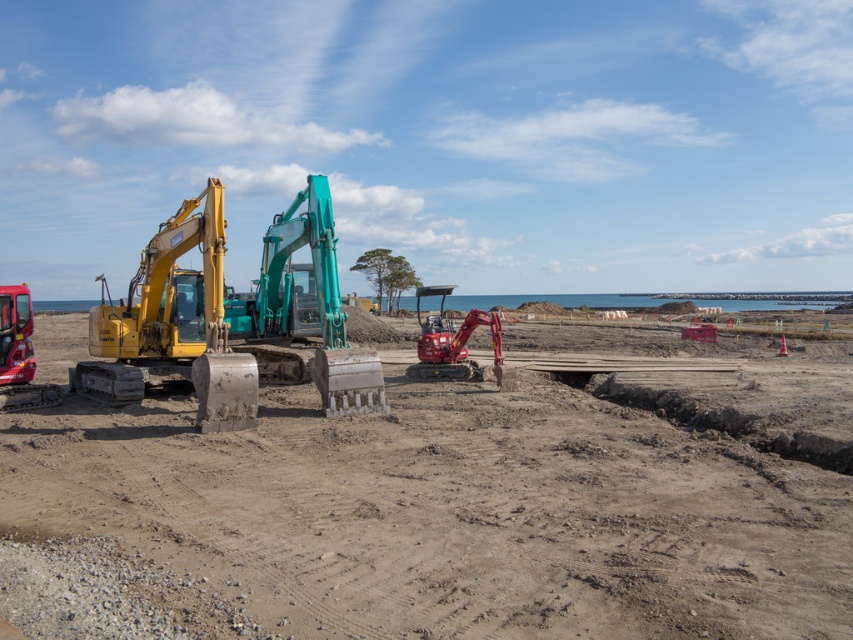
You are a construction worker who needs to move the yellow metallic excavator at left and the matte red excavator at center to a storage area. The storage area has a limited space that can only accommodate the smaller of the two. Which excavator should you prioritize moving first to ensure it fits?

The yellow metallic excavator at left should be prioritized because it occupies less space than the matte red excavator at center, making it the smaller one that will fit in the storage area.

You are a construction worker standing near the yellow metallic excavator at left. You need to move to the teal metallic excavator at center to operate it. Which direction should you walk to reach it?

You should walk towards the teal metallic excavator at center, which is located behind the yellow metallic excavator at left since the yellow one is closer to you.

You are a construction worker who needs to move the yellow metallic excavator at left and the matte red excavator at center closer together to fit them into a narrow storage area. Based on their widths, which excavator should you adjust first to ensure they can fit?

The yellow metallic excavator at left might be wider than the matte red excavator at center, so you should adjust the position of the matte red excavator at center first to accommodate the wider yellow metallic excavator at left.